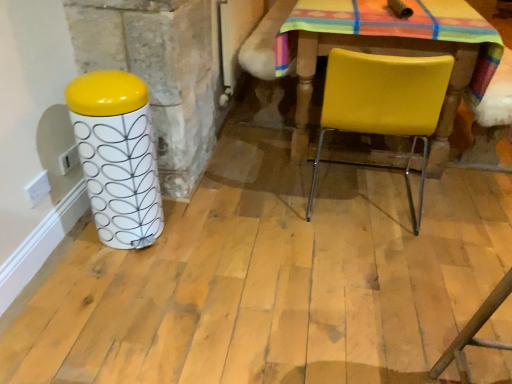
Identify the location of vacant space to the left of yellow leather chair at center. (269, 197).